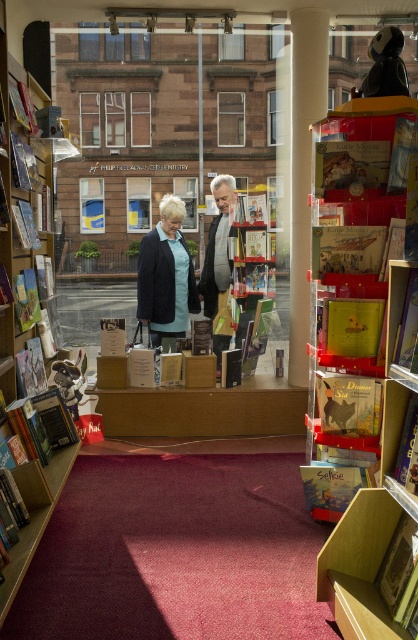
Question: Estimate the real-world distances between objects in this image. Which object is farther from the white smooth pillar at center?

Choices:
 (A) wooden bookshelf at left
 (B) matte black jacket at center

Answer: (A)

Question: Estimate the real-world distances between objects in this image. Which object is farther from the matte black jacket at center?

Choices:
 (A) hardcover book at center
 (B) gray wool sweater at center
 (C) white smooth pillar at center
 (D) wooden bookshelf at left

Answer: (A)

Question: Does wooden bookshelf at left have a greater width compared to gray wool sweater at center?

Choices:
 (A) no
 (B) yes

Answer: (B)

Question: Is the position of wooden bookshelf at left less distant than that of hardcover book at center?

Choices:
 (A) no
 (B) yes

Answer: (B)

Question: Considering the relative positions of matte black jacket at center and hardcover book at center in the image provided, where is matte black jacket at center located with respect to hardcover book at center?

Choices:
 (A) below
 (B) above

Answer: (B)

Question: Estimate the real-world distances between objects in this image. Which object is farther from the matte plastic bookshelf at right?

Choices:
 (A) matte black jacket at center
 (B) hardcover book at center
 (C) wooden bookshelf at left

Answer: (A)